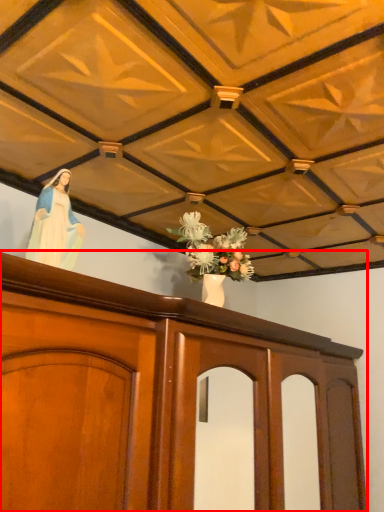
Question: From the image's perspective, where is furniture (annotated by the red box) located in relation to woman in the image?

Choices:
 (A) above
 (B) below

Answer: (B)